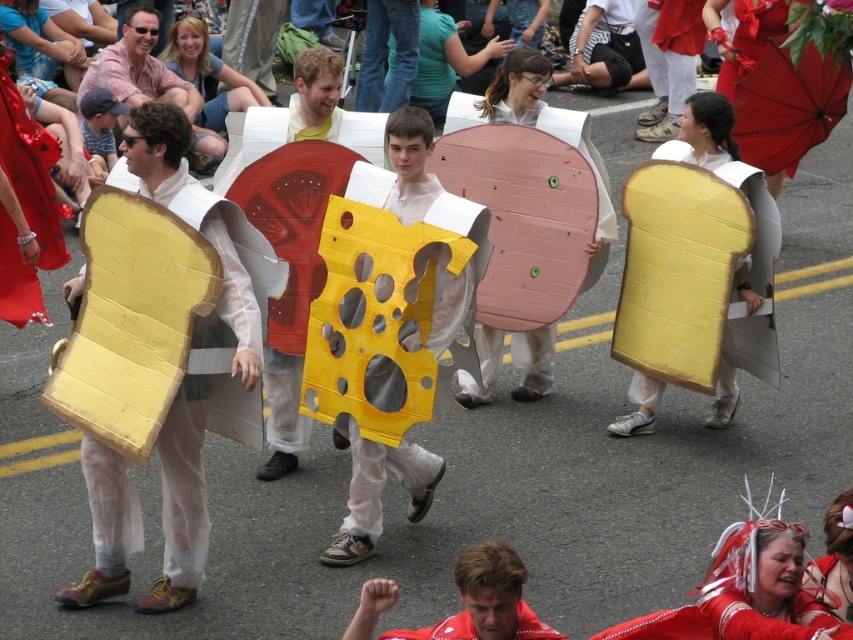
Does matte yellow bread at left appear over matte white cheese at center?

Indeed, matte yellow bread at left is positioned over matte white cheese at center.

Can you confirm if matte yellow bread at left is positioned below matte white cheese at center?

Actually, matte yellow bread at left is above matte white cheese at center.

Locate an element on the screen. matte yellow bread at left is located at coordinates (207, 406).

Which is below, matte yellow bread at left or matte red shirt at center?

Positioned lower is matte red shirt at center.

Is point (181, 589) in front of point (517, 564)?

No.

I want to click on matte yellow bread at left, so click(207, 406).

Is point (445, 618) more distant than point (170, 88)?

No, it is not.

Can you confirm if matte red shirt at center is bigger than matte pink shirt at upper left?

Actually, matte red shirt at center might be smaller than matte pink shirt at upper left.

Which is in front, point (476, 557) or point (103, 49)?

Point (476, 557) is more forward.

Find the location of a particular element. This screenshot has width=853, height=640. matte red shirt at center is located at coordinates (486, 600).